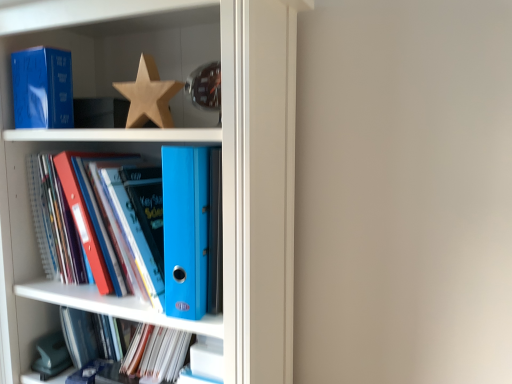
Question: In which direction should I rotate to look at matte blue folder at lower center, the first book ordered from the bottom?

Choices:
 (A) left
 (B) right

Answer: (A)

Question: Is the surface of blue plastic ring binder at center, the second book in the bottom-to-top sequence, in direct contact with matte blue folder at lower center, placed as the second book when sorted from top to bottom?

Choices:
 (A) no
 (B) yes

Answer: (A)

Question: From a real-world perspective, is blue plastic ring binder at center, the second book in the bottom-to-top sequence, positioned over matte blue folder at lower center, the first book ordered from the bottom, based on gravity?

Choices:
 (A) yes
 (B) no

Answer: (A)

Question: From a real-world perspective, is blue plastic ring binder at center, the second book in the bottom-to-top sequence, beneath matte blue folder at lower center, the first book ordered from the bottom?

Choices:
 (A) no
 (B) yes

Answer: (A)

Question: Is blue plastic ring binder at center, the second book in the bottom-to-top sequence, surrounding matte blue folder at lower center, the first book ordered from the bottom?

Choices:
 (A) no
 (B) yes

Answer: (A)

Question: Does blue plastic ring binder at center, the second book in the bottom-to-top sequence, lie behind matte blue folder at lower center, the first book ordered from the bottom?

Choices:
 (A) no
 (B) yes

Answer: (A)

Question: Is blue plastic ring binder at center, the second book in the bottom-to-top sequence, smaller than matte blue folder at lower center, placed as the second book when sorted from top to bottom?

Choices:
 (A) yes
 (B) no

Answer: (B)

Question: Is the position of blue plastic ring binder at center, the second book in the bottom-to-top sequence, more distant than that of matte blue paperback book at upper left?

Choices:
 (A) yes
 (B) no

Answer: (B)

Question: Can you confirm if blue plastic ring binder at center, the second book in the bottom-to-top sequence, is shorter than matte blue paperback book at upper left?

Choices:
 (A) yes
 (B) no

Answer: (B)

Question: Considering the relative sizes of blue plastic ring binder at center, placed as the first book when sorted from top to bottom, and matte blue paperback book at upper left in the image provided, is blue plastic ring binder at center, placed as the first book when sorted from top to bottom, wider than matte blue paperback book at upper left?

Choices:
 (A) no
 (B) yes

Answer: (B)

Question: Are blue plastic ring binder at center, the second book in the bottom-to-top sequence, and matte blue paperback book at upper left beside each other?

Choices:
 (A) yes
 (B) no

Answer: (B)

Question: Is blue plastic ring binder at center, the second book in the bottom-to-top sequence, to the right of matte blue paperback book at upper left from the viewer's perspective?

Choices:
 (A) no
 (B) yes

Answer: (B)

Question: From a real-world perspective, does blue plastic ring binder at center, placed as the first book when sorted from top to bottom, sit lower than matte blue paperback book at upper left?

Choices:
 (A) yes
 (B) no

Answer: (A)

Question: From the image's perspective, is matte blue paperback book at upper left beneath matte blue folder at lower center, the first book ordered from the bottom?

Choices:
 (A) no
 (B) yes

Answer: (A)